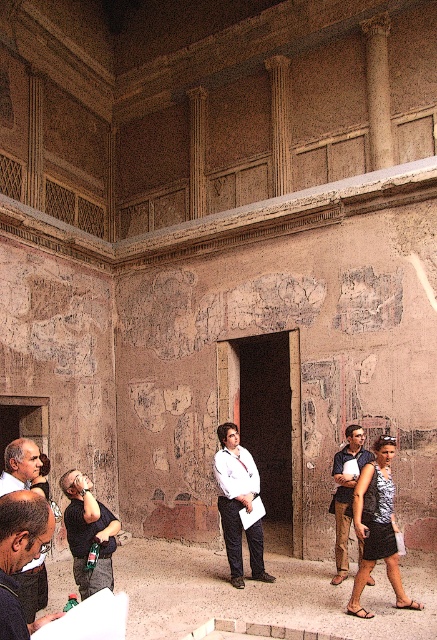
Does printed fabric dress at lower right have a greater height compared to white shirt at center?

No, printed fabric dress at lower right is not taller than white shirt at center.

Is printed fabric dress at lower right positioned before white shirt at center?

Yes, printed fabric dress at lower right is in front of white shirt at center.

Measure the distance between point (419,605) and camera.

Point (419,605) is 33.66 feet from camera.

The height and width of the screenshot is (640, 437). I want to click on printed fabric dress at lower right, so pyautogui.click(x=377, y=528).

Is point (243, 496) in front of point (336, 579)?

No.

Does point (263, 576) come in front of point (343, 540)?

Yes, point (263, 576) is in front of point (343, 540).

I want to click on white shirt at center, so click(233, 493).

Looking at this image, does white shirt at center lie behind dark gray suit at lower left?

Yes, white shirt at center is further from the viewer.

Which is more to the left, white shirt at center or dark gray suit at lower left?

dark gray suit at lower left is more to the left.

Does point (235, 500) lie in front of point (18, 456)?

No, it is not.

Image resolution: width=437 pixels, height=640 pixels. In order to click on white shirt at center in this screenshot , I will do `click(233, 493)`.